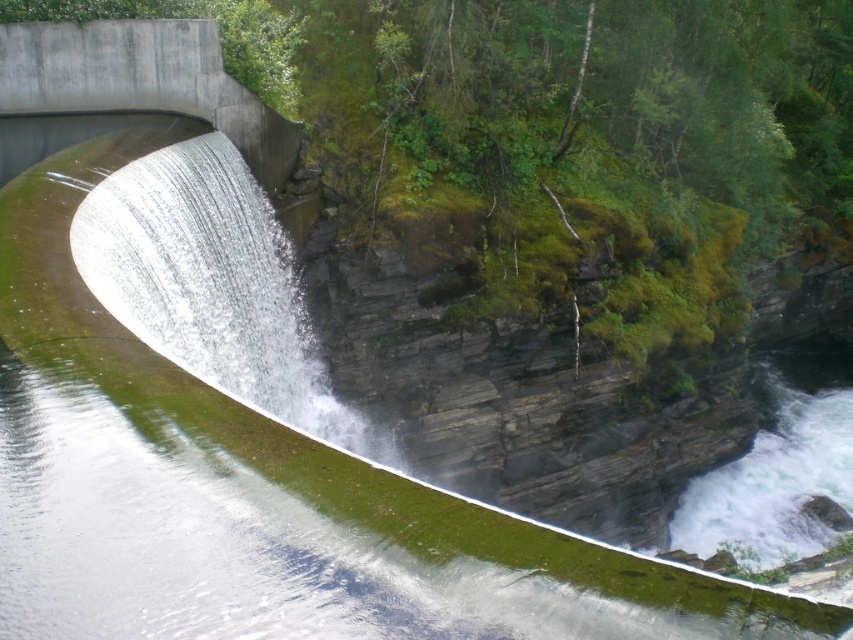
Question: Can you confirm if clear water at center is positioned to the right of concrete bridge at upper left?

Choices:
 (A) no
 (B) yes

Answer: (B)

Question: Does clear water at center appear on the left side of concrete bridge at upper left?

Choices:
 (A) yes
 (B) no

Answer: (B)

Question: Which object appears closest to the camera in this image?

Choices:
 (A) concrete bridge at upper left
 (B) clear water at center

Answer: (B)

Question: Is clear water at center closer to the viewer compared to concrete bridge at upper left?

Choices:
 (A) no
 (B) yes

Answer: (B)

Question: Which point appears farthest from the camera in this image?

Choices:
 (A) (198, 364)
 (B) (108, 54)

Answer: (B)